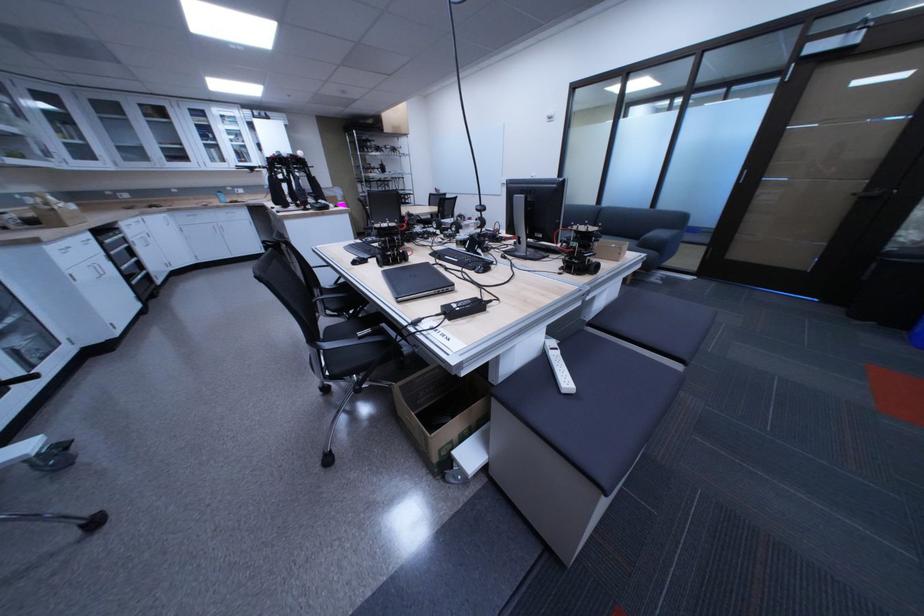
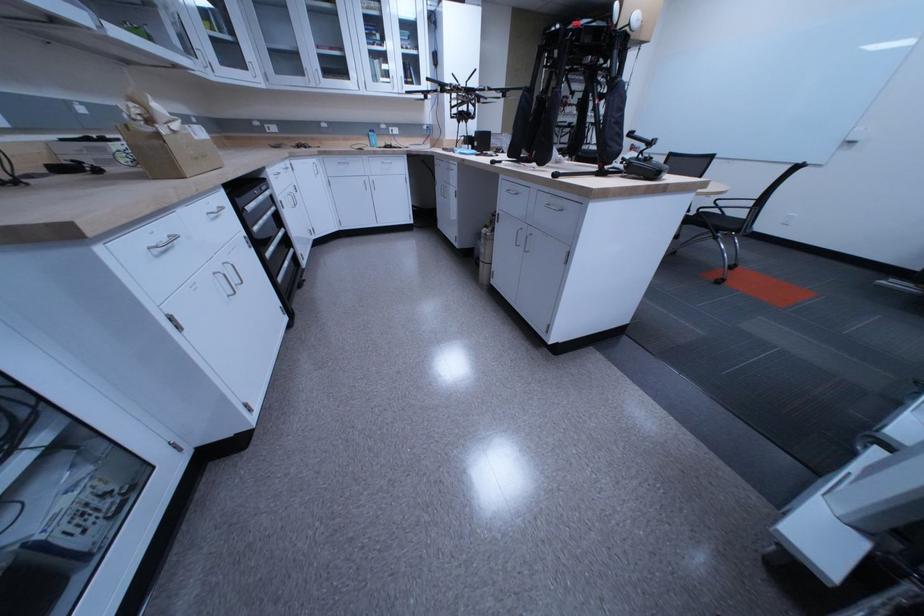
In the second image, find the point that corresponds to point 224,200 in the first image.

(373, 140)